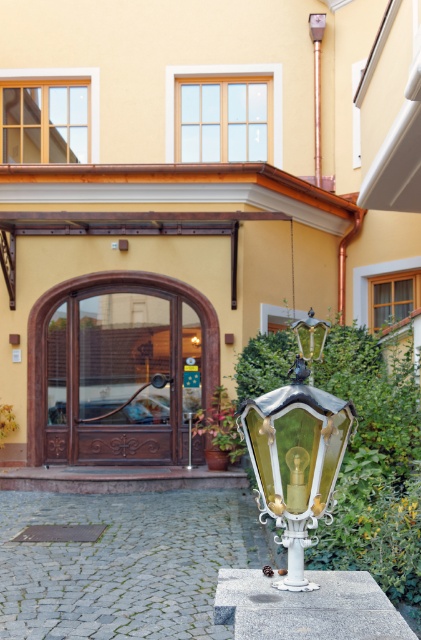
Does green glass lamp post at center appear on the right side of metallic copper pole at upper center?

In fact, green glass lamp post at center is to the left of metallic copper pole at upper center.

How distant is green glass lamp post at center from metallic copper pole at upper center?

green glass lamp post at center is 11.77 meters away from metallic copper pole at upper center.

Who is more forward, (x=314, y=356) or (x=314, y=84)?

Point (x=314, y=356)

Locate an element on the screen. This screenshot has width=421, height=640. green glass lamp post at center is located at coordinates (296, 451).